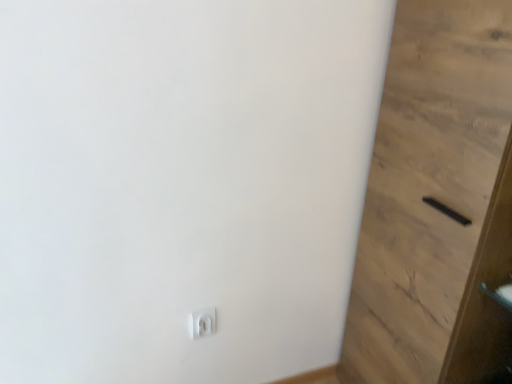
What is the approximate width of black matte door at lower right?

It is 34.51 centimeters.

Looking at this image, measure the distance between black matte door at lower right and camera.

The distance of black matte door at lower right from camera is 34.52 inches.

Measure the distance between point (476, 374) and camera.

4.08 feet.

Identify the location of black matte door at lower right. The height and width of the screenshot is (384, 512). (436, 202).

What do you see at coordinates (436, 202) in the screenshot? The image size is (512, 384). I see `black matte door at lower right` at bounding box center [436, 202].

The width and height of the screenshot is (512, 384). Identify the location of white plastic light switch at lower center. (202, 322).

The width and height of the screenshot is (512, 384). What do you see at coordinates (202, 322) in the screenshot? I see `white plastic light switch at lower center` at bounding box center [202, 322].

Identify the location of black matte door at lower right. (436, 202).

Is black matte door at lower right to the left of white plastic light switch at lower center from the viewer's perspective?

Incorrect, black matte door at lower right is not on the left side of white plastic light switch at lower center.

Is black matte door at lower right positioned before white plastic light switch at lower center?

Yes, the depth of black matte door at lower right is less than that of white plastic light switch at lower center.

Does point (398, 81) lie in front of point (207, 321)?

Yes.

From the image's perspective, is black matte door at lower right below white plastic light switch at lower center?

Actually, black matte door at lower right appears above white plastic light switch at lower center in the image.

From a real-world perspective, which is physically above, black matte door at lower right or white plastic light switch at lower center?

black matte door at lower right.

Considering the sizes of black matte door at lower right and white plastic light switch at lower center in the image, is black matte door at lower right wider or thinner than white plastic light switch at lower center?

Clearly, black matte door at lower right has more width compared to white plastic light switch at lower center.

Looking at this image, is black matte door at lower right taller or shorter than white plastic light switch at lower center?

In the image, black matte door at lower right appears to be taller than white plastic light switch at lower center.

Considering the relative sizes of black matte door at lower right and white plastic light switch at lower center in the image provided, is black matte door at lower right bigger than white plastic light switch at lower center?

Yes, black matte door at lower right is bigger than white plastic light switch at lower center.

Is black matte door at lower right completely or partially outside of white plastic light switch at lower center?

Indeed, black matte door at lower right is completely outside white plastic light switch at lower center.

Is black matte door at lower right not near white plastic light switch at lower center?

Actually, black matte door at lower right and white plastic light switch at lower center are a little close together.

Is black matte door at lower right turned away from white plastic light switch at lower center?

black matte door at lower right does not have its back to white plastic light switch at lower center.

Locate an element on the screen. Image resolution: width=512 pixels, height=384 pixels. door lying in front of the white plastic light switch at lower center is located at coordinates (436, 202).

Which is more to the left, white plastic light switch at lower center or black matte door at lower right?

white plastic light switch at lower center is more to the left.

Which object is closer to the camera, white plastic light switch at lower center or black matte door at lower right?

black matte door at lower right.

Does point (188, 319) appear closer or farther from the camera than point (400, 181)?

Point (188, 319) is positioned farther from the camera compared to point (400, 181).

From the image's perspective, relative to black matte door at lower right, is white plastic light switch at lower center above or below?

Based on their image positions, white plastic light switch at lower center is located beneath black matte door at lower right.

Looking at this image, from a real-world perspective, is white plastic light switch at lower center below black matte door at lower right?

Yes, from a real-world perspective, white plastic light switch at lower center is below black matte door at lower right.

Is white plastic light switch at lower center thinner than black matte door at lower right?

Yes, white plastic light switch at lower center is thinner than black matte door at lower right.

Is white plastic light switch at lower center taller or shorter than black matte door at lower right?

Considering their sizes, white plastic light switch at lower center has less height than black matte door at lower right.

Can you confirm if white plastic light switch at lower center is smaller than black matte door at lower right?

Yes, white plastic light switch at lower center is smaller than black matte door at lower right.

Is black matte door at lower right located within white plastic light switch at lower center?

No.

Can you see white plastic light switch at lower center touching black matte door at lower right?

No, white plastic light switch at lower center is not making contact with black matte door at lower right.

Based on the photo, does white plastic light switch at lower center turn towards black matte door at lower right?

No, white plastic light switch at lower center is not aimed at black matte door at lower right.

How distant is white plastic light switch at lower center from black matte door at lower right?

30.90 inches.

At what (x,y) coordinates should I click in order to perform the action: click on door located above the white plastic light switch at lower center (from the image's perspective). Please return your answer as a coordinate pair (x, y). The image size is (512, 384). Looking at the image, I should click on (436, 202).

This screenshot has width=512, height=384. In order to click on light switch that appears on the left of black matte door at lower right in this screenshot , I will do `click(202, 322)`.

Where is `door positioned vertically above the white plastic light switch at lower center (from a real-world perspective)`? door positioned vertically above the white plastic light switch at lower center (from a real-world perspective) is located at coordinates 436,202.